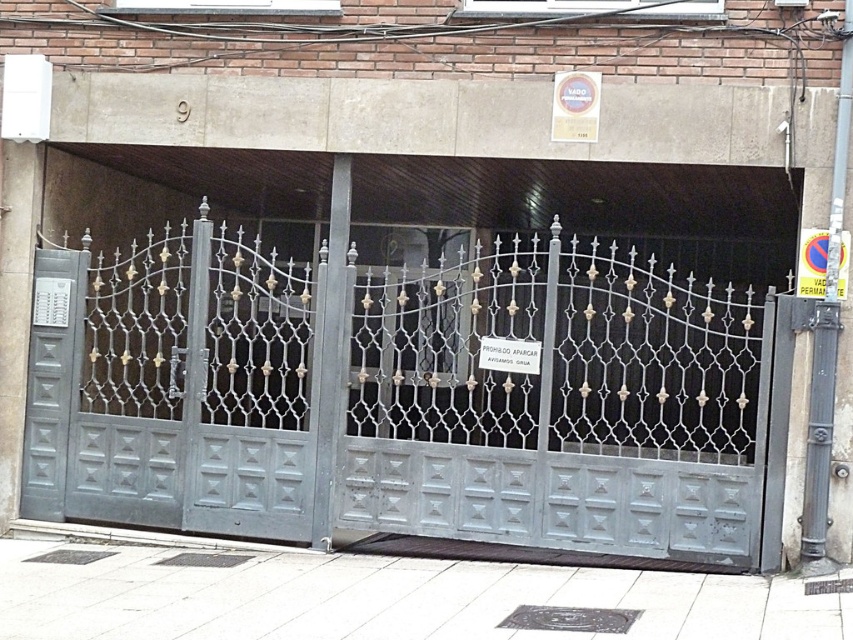
Based on the photo, how distant is metallic gate at center from matte gray door at left?

The distance of metallic gate at center from matte gray door at left is 4.35 feet.

Identify the location of metallic gate at center. (407, 396).